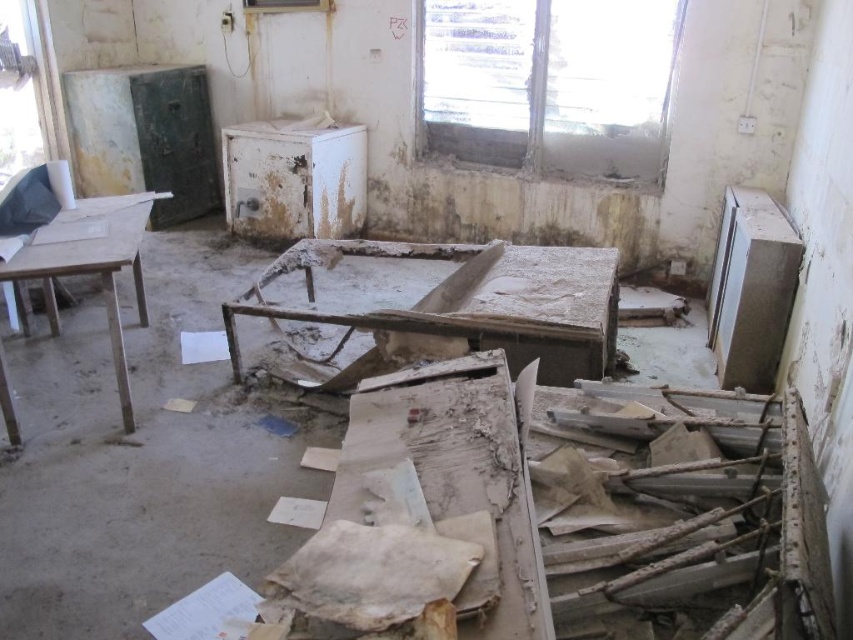
Question: Can you confirm if dirty wooden table at center is thinner than wooden table at left?

Choices:
 (A) no
 (B) yes

Answer: (A)

Question: Is dirty wooden table at center bigger than wooden table at left?

Choices:
 (A) no
 (B) yes

Answer: (B)

Question: Which point appears farthest from the camera in this image?

Choices:
 (A) (410, 253)
 (B) (21, 323)

Answer: (B)

Question: Does dirty wooden table at center appear under wooden table at left?

Choices:
 (A) yes
 (B) no

Answer: (A)

Question: Which object appears farthest from the camera in this image?

Choices:
 (A) wooden table at left
 (B) dirty wooden table at center

Answer: (B)